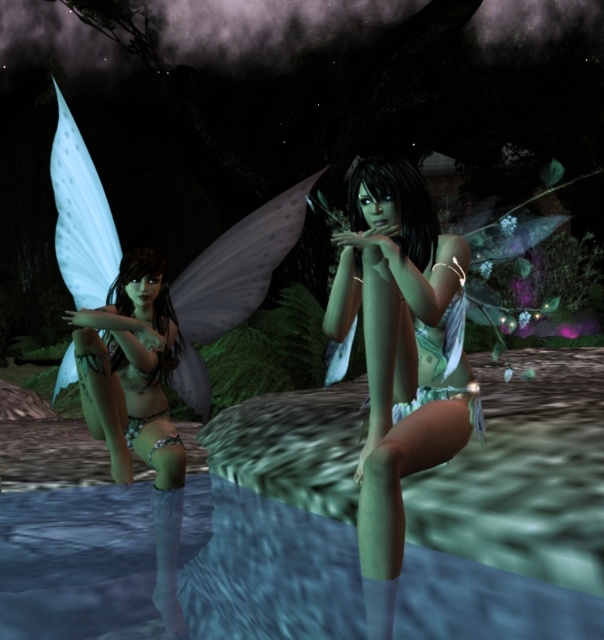
Question: Which object is closer to the camera taking this photo?

Choices:
 (A) translucent white wings at left
 (B) translucent blue water at lower center
 (C) green matte bikini at center

Answer: (C)

Question: Which of the following is the closest to the observer?

Choices:
 (A) (156, 540)
 (B) (312, 625)
 (C) (396, 216)

Answer: (C)

Question: Is translucent blue water at lower center positioned at the back of green matte bikini at center?

Choices:
 (A) yes
 (B) no

Answer: (A)

Question: Which object is farther from the camera taking this photo?

Choices:
 (A) translucent white wings at left
 (B) translucent blue water at lower center
 (C) green matte bikini at center

Answer: (A)

Question: From the image, what is the correct spatial relationship of translucent blue water at lower center in relation to green matte bikini at center?

Choices:
 (A) below
 (B) above

Answer: (A)

Question: Does translucent blue water at lower center have a greater width compared to green matte bikini at center?

Choices:
 (A) no
 (B) yes

Answer: (B)